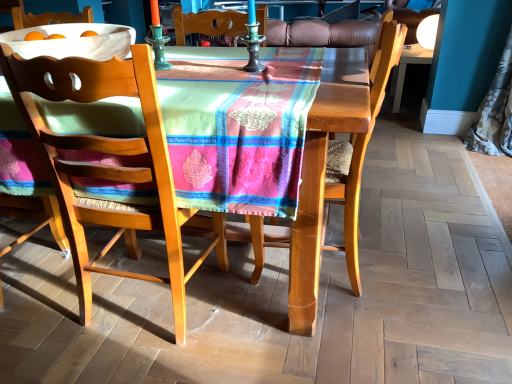
Question: Is wooden chair with woven seat at center, the second chair positioned from the right, looking in the opposite direction of wooden chair at center, the first chair viewed from the right?

Choices:
 (A) no
 (B) yes

Answer: (A)

Question: Considering the relative sizes of wooden chair with woven seat at center, the second chair positioned from the right, and wooden chair at center, arranged as the second chair when viewed from the left, in the image provided, is wooden chair with woven seat at center, the second chair positioned from the right, wider than wooden chair at center, arranged as the second chair when viewed from the left,?

Choices:
 (A) yes
 (B) no

Answer: (B)

Question: Can you confirm if wooden chair with woven seat at center, the second chair positioned from the right, is bigger than wooden chair at center, arranged as the second chair when viewed from the left?

Choices:
 (A) yes
 (B) no

Answer: (A)

Question: From a real-world perspective, is wooden chair with woven seat at center, arranged as the first chair when viewed from the left, positioned over wooden chair at center, arranged as the second chair when viewed from the left, based on gravity?

Choices:
 (A) no
 (B) yes

Answer: (A)

Question: Could you tell me if wooden chair with woven seat at center, arranged as the first chair when viewed from the left, is turned towards wooden chair at center, the first chair viewed from the right?

Choices:
 (A) yes
 (B) no

Answer: (B)

Question: Does wooden chair at center, the first chair viewed from the right, appear on the left side of matte black desk at upper right?

Choices:
 (A) no
 (B) yes

Answer: (B)

Question: From a real-world perspective, is wooden chair at center, the first chair viewed from the right, positioned over matte black desk at upper right based on gravity?

Choices:
 (A) no
 (B) yes

Answer: (B)

Question: Is wooden chair at center, the first chair viewed from the right, not close to matte black desk at upper right?

Choices:
 (A) yes
 (B) no

Answer: (A)

Question: Does wooden chair at center, arranged as the second chair when viewed from the left, turn towards matte black desk at upper right?

Choices:
 (A) yes
 (B) no

Answer: (B)

Question: From a real-world perspective, is wooden chair at center, arranged as the second chair when viewed from the left, under matte black desk at upper right?

Choices:
 (A) no
 (B) yes

Answer: (A)

Question: From the image's perspective, would you say wooden chair at center, arranged as the second chair when viewed from the left, is shown under matte black desk at upper right?

Choices:
 (A) no
 (B) yes

Answer: (B)

Question: Does wooden chair at center, arranged as the second chair when viewed from the left, turn towards wooden chair with woven seat at center, arranged as the first chair when viewed from the left?

Choices:
 (A) yes
 (B) no

Answer: (B)